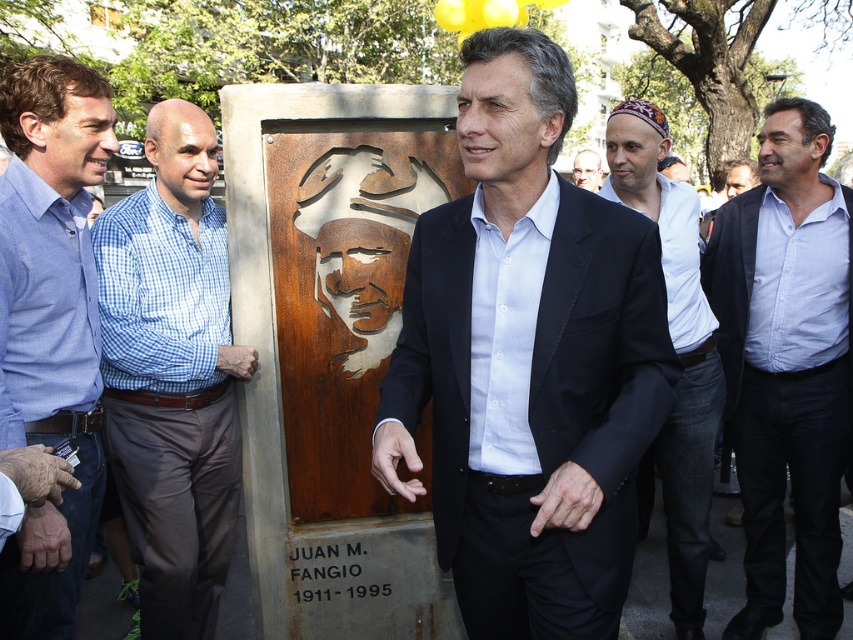
You are a photographer aiming to capture a photo of the commemorative plaque. You notice a person wearing a blue shirt at center and a light brown leather belt at center blocking the view. Which clothing item is closer to the left side of the plaque?

The blue shirt at center is positioned on the left side of the light brown leather belt at center, so the blue shirt at center is closer to the left side of the plaque.

You are a photographer aiming to capture a closeup of the blue shirt at center and the light brown leather belt at center. Since you want to focus on the belt, which part should you adjust your camera to focus on first?

The blue shirt at center is positioned under the light brown leather belt at center, so you should focus on the light brown leather belt at center first as it is higher up.

You are a photographer trying to capture a photo of the matte brown statue at center while ensuring the blue checkered shirt at center is visible in the frame. Based on their positions, which side of the statue should you position yourself to include both subjects?

To include both the blue checkered shirt at center and the matte brown statue at center in your photo, you should position yourself to the right side of the statue. Since the blue checkered shirt at center is to the left of the matte brown statue at center, positioning yourself to the right allows you to capture both subjects within the frame.